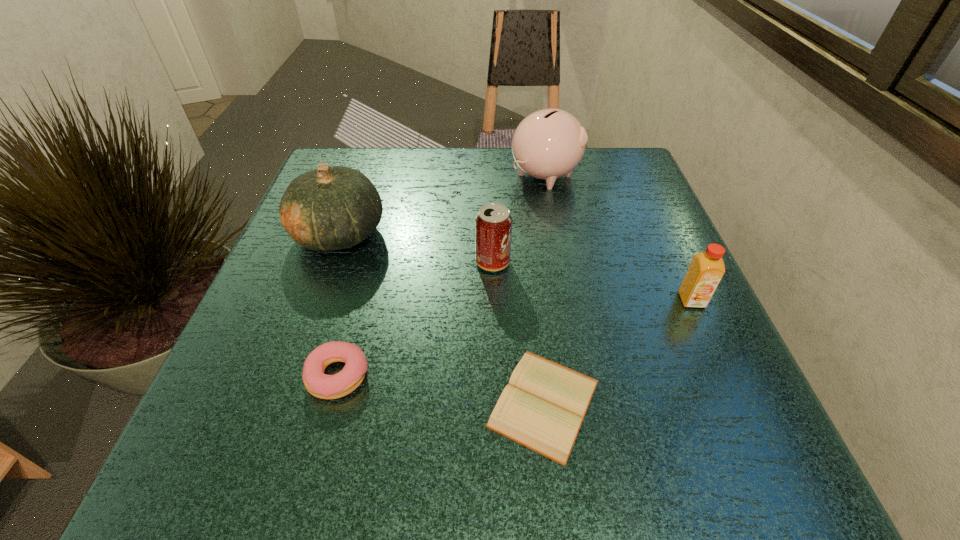
Where is `piggy bank`? This screenshot has height=540, width=960. piggy bank is located at coordinates click(549, 143).

Find the location of a particular element. This screenshot has height=540, width=960. gourd is located at coordinates (329, 208).

The height and width of the screenshot is (540, 960). I want to click on the rightmost object, so click(x=706, y=270).

Identify the location of orange juice. This screenshot has width=960, height=540. (706, 270).

You are a GUI agent. You are given a task and a screenshot of the screen. Output one action in this format:
    pyautogui.click(x=<x>, y=<y>)
    Task: Click on the soda can
    This screenshot has width=960, height=540.
    Given the screenshot: What is the action you would take?
    pyautogui.click(x=493, y=224)

Locate an element on the screen. This screenshot has height=540, width=960. doughnut is located at coordinates (318, 384).

Where is `the shortest object`? the shortest object is located at coordinates (542, 408).

I want to click on vacant space located on the left of the piggy bank, so click(x=413, y=175).

This screenshot has width=960, height=540. Find the location of `vacant space located on the back of the gourd`. vacant space located on the back of the gourd is located at coordinates (355, 191).

Locate an element on the screen. This screenshot has height=540, width=960. vacant area located on the front and back of the fourth farthest object is located at coordinates (746, 419).